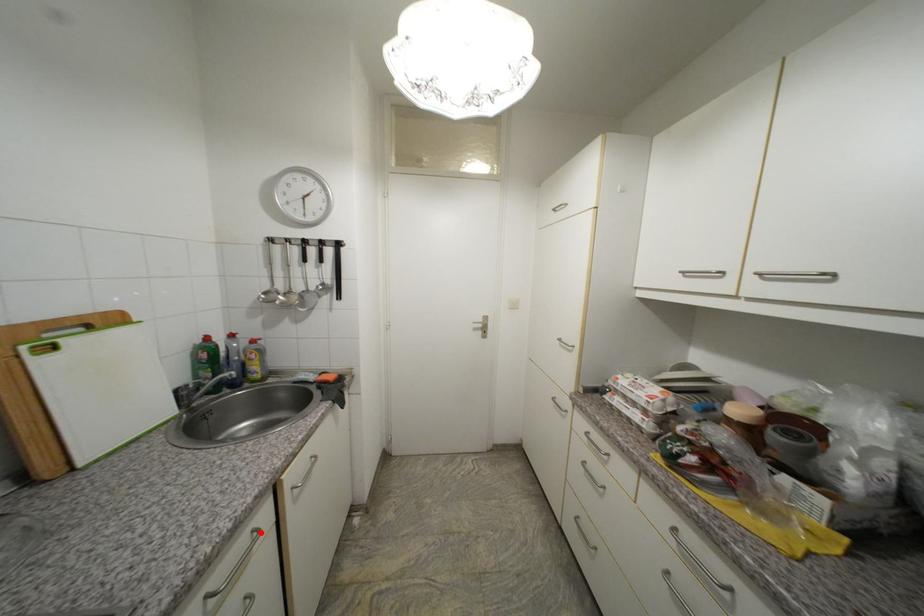
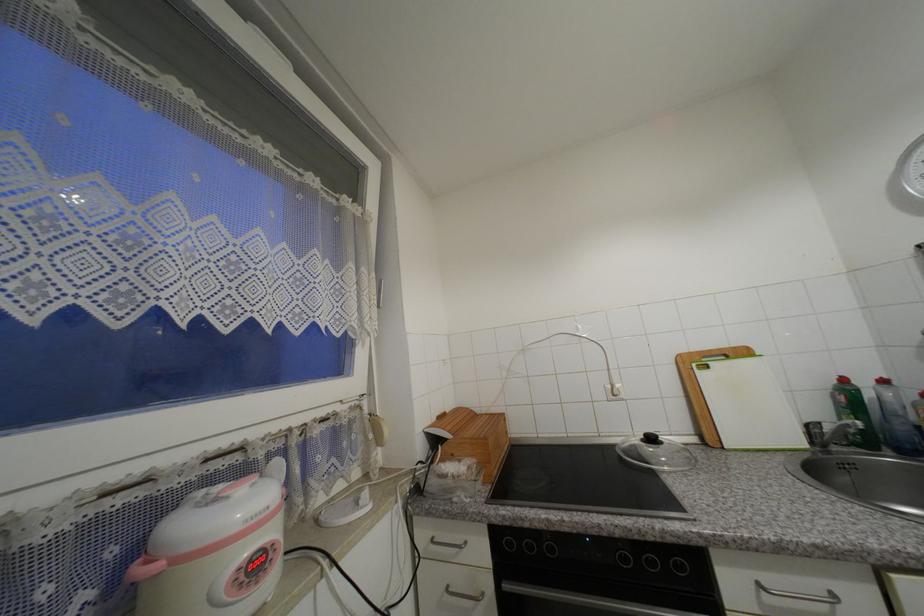
Locate, in the second image, the point that corresponds to the highlighted location in the first image.

(840, 597)